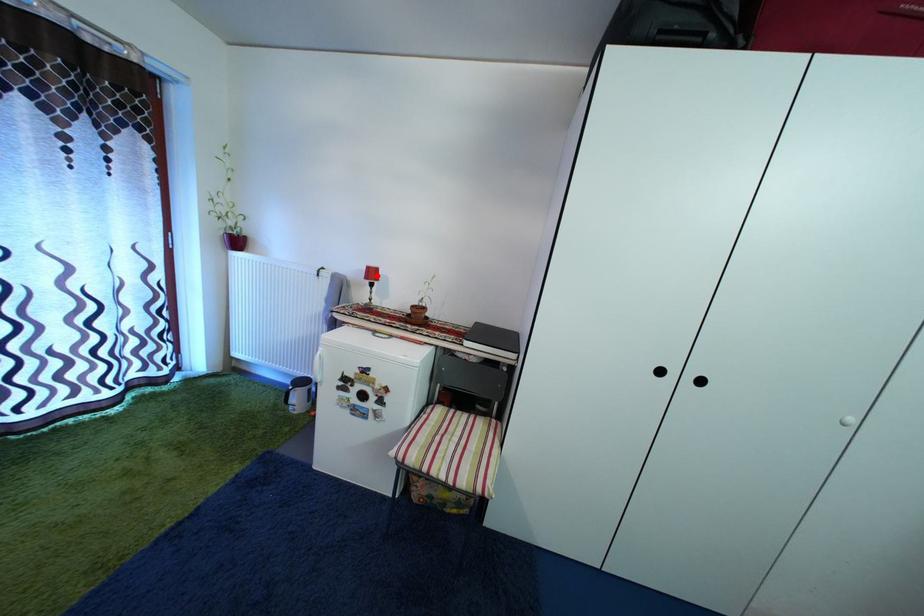
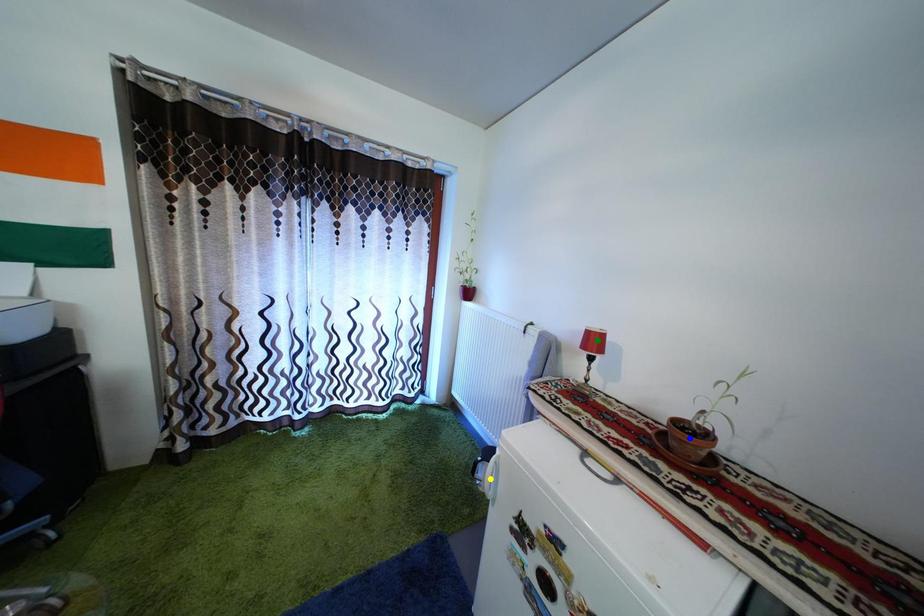
Question: I am providing you with two images of the same scene from different viewpoints. A red point is marked on the first image. You are given multiple points on the second image. In image 2, which mark is for the same physical point as the one in image 1?

Choices:
 (A) yellow point
 (B) green point
 (C) blue point

Answer: (B)